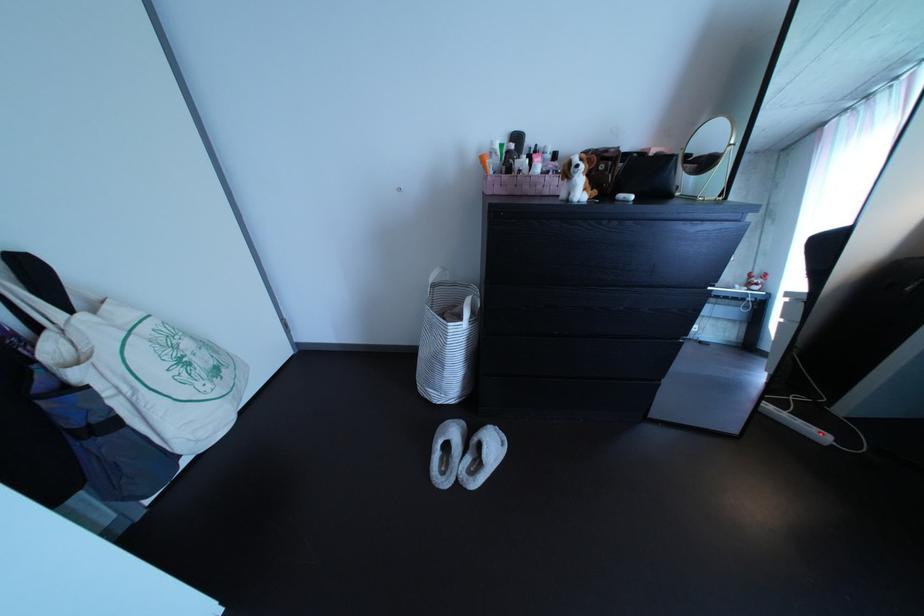
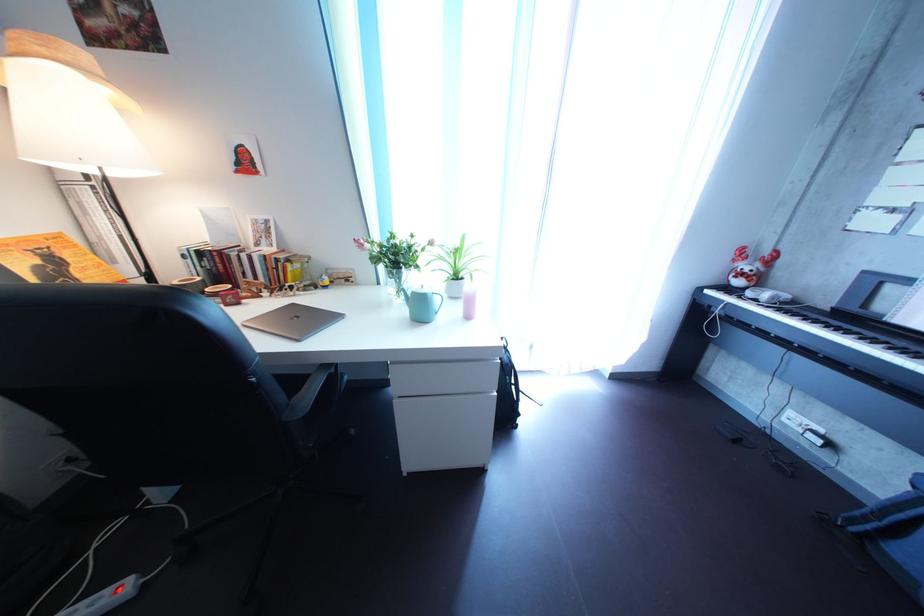
Where in the second image is the point corresponding to point (832, 438) from the first image?

(122, 601)